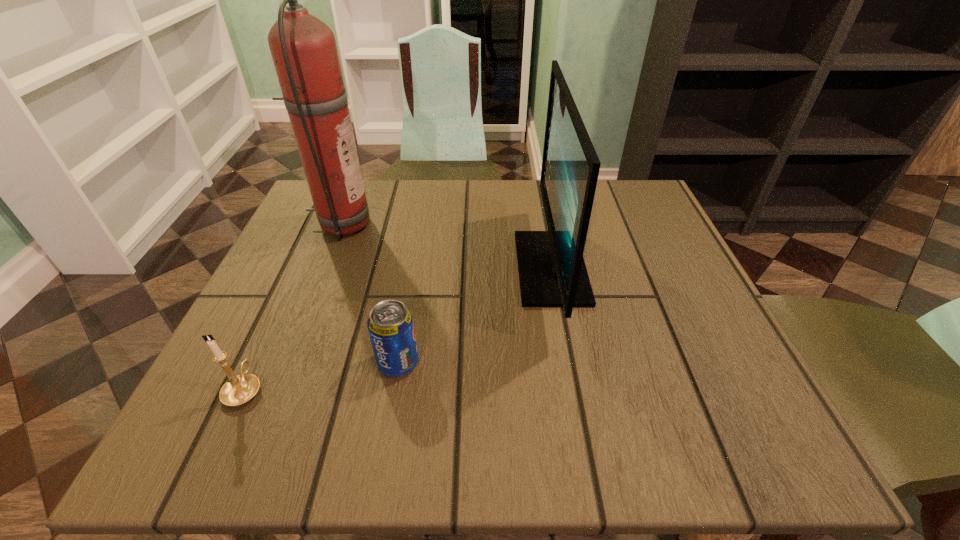
Image resolution: width=960 pixels, height=540 pixels. Find the location of `free space located on the handle side of the candle holder`. free space located on the handle side of the candle holder is located at coordinates pos(303,260).

At what (x,y) coordinates should I click in order to perform the action: click on vacant point located on the handle side of the candle holder. Please return your answer as a coordinate pair (x, y). Looking at the image, I should click on (273, 327).

Find the location of a particular element. free space located 0.050m on the front of the soda is located at coordinates (391, 409).

Find the location of `fire extinguisher situated at the far edge`. fire extinguisher situated at the far edge is located at coordinates (303, 48).

Locate an element on the screen. This screenshot has width=960, height=540. monitor that is at the far edge is located at coordinates (552, 273).

Where is `object positioned at the near edge`? The width and height of the screenshot is (960, 540). object positioned at the near edge is located at coordinates (239, 389).

Locate an element on the screen. Image resolution: width=960 pixels, height=540 pixels. fire extinguisher present at the left edge is located at coordinates (303, 48).

The image size is (960, 540). Find the location of `candle holder located at the left edge`. candle holder located at the left edge is located at coordinates (239, 389).

This screenshot has height=540, width=960. Find the location of `object present at the far left corner`. object present at the far left corner is located at coordinates (303, 48).

Locate an element on the screen. This screenshot has height=540, width=960. object that is at the near left corner is located at coordinates (239, 389).